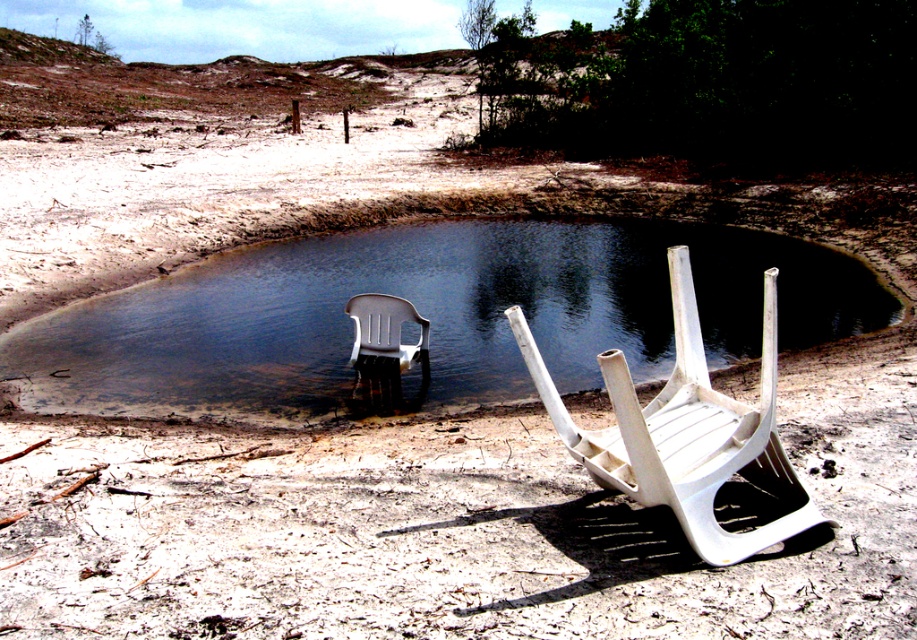
Question: Is clear water at chair left wider than white plastic chair at lower right?

Choices:
 (A) no
 (B) yes

Answer: (B)

Question: Which point appears closest to the camera in this image?

Choices:
 (A) (705, 481)
 (B) (130, 305)

Answer: (A)

Question: Which point appears closest to the camera in this image?

Choices:
 (A) (693, 472)
 (B) (514, 621)
 (C) (594, 348)

Answer: (B)

Question: Which point appears closest to the camera in this image?

Choices:
 (A) (398, 314)
 (B) (554, 419)

Answer: (B)

Question: Can you confirm if clear water at chair left is wider than white plastic chair at lower right?

Choices:
 (A) yes
 (B) no

Answer: (A)

Question: Can you confirm if clear water at chair left is wider than white plastic chair at lower right?

Choices:
 (A) no
 (B) yes

Answer: (B)